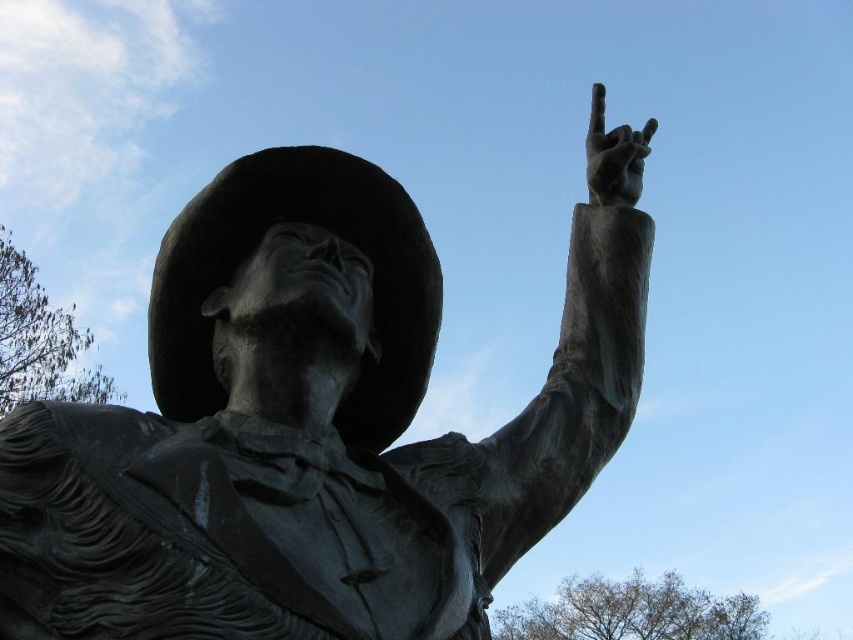
You are standing in front of the bronze statue of a man. There are two points marked on the statue at coordinates point (364,408) and point (634,164). Which point is closer to you?

Point (364,408) is closer to the viewer than point (634,164).

You are standing directly in front of the bronze statue at upper center. If you look up at the statue, where would you see the point marked at coordinate [308,429]?

The point marked at coordinate [308,429] indicates the bronze statue at upper center.